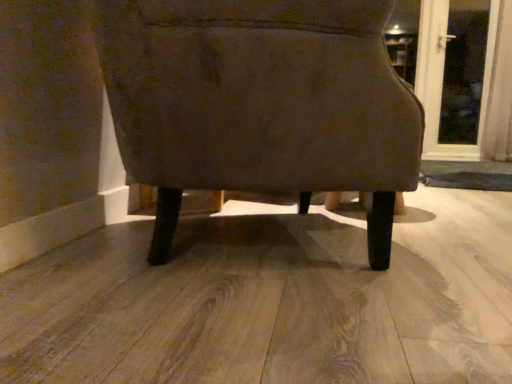
Question: From the image's perspective, relative to transparent glass door at upper right, is suede-like brown chair at center above or below?

Choices:
 (A) below
 (B) above

Answer: (A)

Question: Relative to transparent glass door at upper right, is suede-like brown chair at center in front or behind?

Choices:
 (A) behind
 (B) front

Answer: (B)

Question: Is point (345, 3) positioned closer to the camera than point (419, 61)?

Choices:
 (A) closer
 (B) farther

Answer: (A)

Question: Would you say transparent glass door at upper right is inside or outside suede-like brown chair at center?

Choices:
 (A) outside
 (B) inside

Answer: (A)

Question: Looking at the image, does transparent glass door at upper right seem bigger or smaller compared to suede-like brown chair at center?

Choices:
 (A) small
 (B) big

Answer: (A)

Question: Is transparent glass door at upper right in front of or behind suede-like brown chair at center in the image?

Choices:
 (A) behind
 (B) front

Answer: (A)

Question: Is transparent glass door at upper right taller or shorter than suede-like brown chair at center?

Choices:
 (A) short
 (B) tall

Answer: (B)